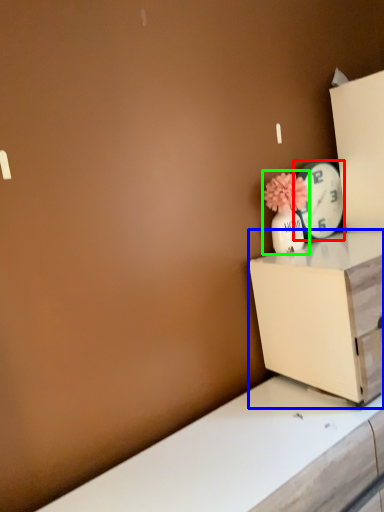
Question: Based on their relative distances, which object is farther from clock (highlighted by a red box)? Choose from nightstand (highlighted by a blue box) and floral arrangement (highlighted by a green box).

Choices:
 (A) nightstand
 (B) floral arrangement

Answer: (A)